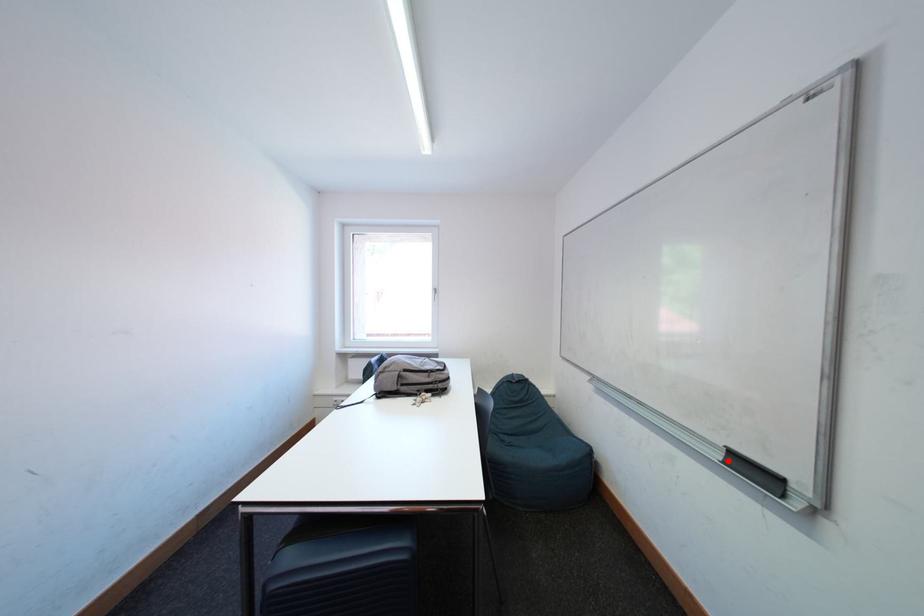
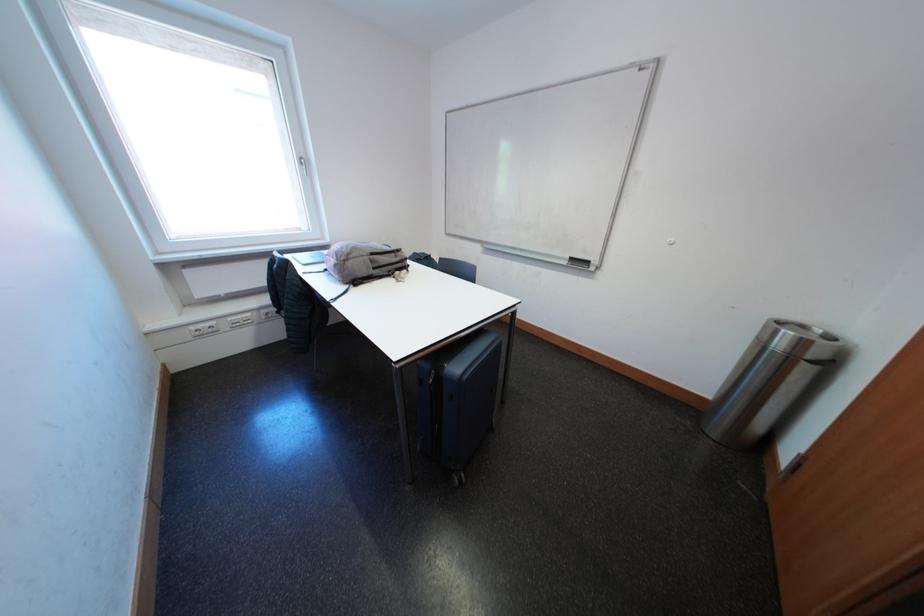
Question: A red point is marked in image1. In image2, is the corresponding 3D point closer to the camera or farther? Reply with the corresponding letter.

Choices:
 (A) The corresponding 3D point is closer.
 (B) The corresponding 3D point is farther.

Answer: (A)